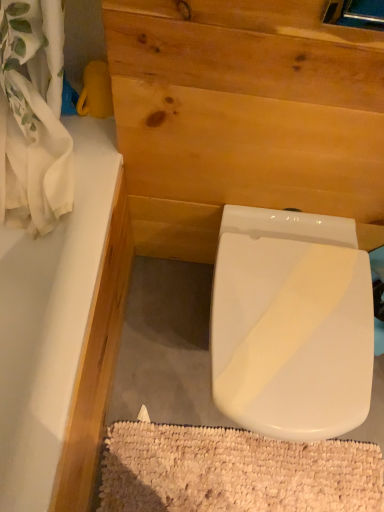
Find the location of a particular element. The height and width of the screenshot is (512, 384). free space above white glossy toilet at center (from a real-world perspective) is located at coordinates (297, 315).